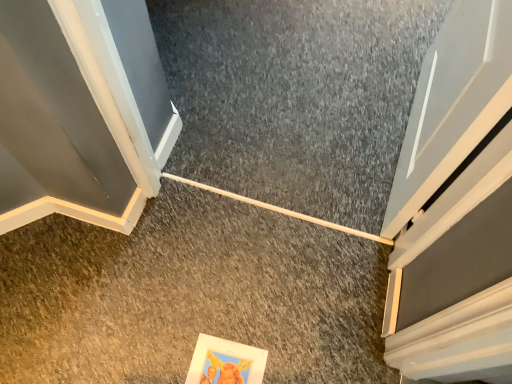
This screenshot has width=512, height=384. What do you see at coordinates (295, 97) in the screenshot? I see `smooth gray carpet at center, arranged as the 1th concrete when viewed from the back` at bounding box center [295, 97].

Find the location of `smooth gray carpet at center, arranged as the 2th concrete when viewed from the front`. smooth gray carpet at center, arranged as the 2th concrete when viewed from the front is located at coordinates (295, 97).

Image resolution: width=512 pixels, height=384 pixels. Describe the element at coordinates (189, 295) in the screenshot. I see `gray carpet at center, which is the second concrete in back-to-front order` at that location.

In order to click on gray carpet at center, the 1th concrete positioned from the front in this screenshot , I will do `click(189, 295)`.

The image size is (512, 384). Identify the location of smooth gray carpet at center, arranged as the 1th concrete when viewed from the back. (295, 97).

Does smooth gray carpet at center, arranged as the 1th concrete when viewed from the back, appear on the right side of gray carpet at center, which is the second concrete in back-to-front order?

Correct, you'll find smooth gray carpet at center, arranged as the 1th concrete when viewed from the back, to the right of gray carpet at center, which is the second concrete in back-to-front order.

In the image, is smooth gray carpet at center, arranged as the 1th concrete when viewed from the back, positioned in front of or behind gray carpet at center, which is the second concrete in back-to-front order?

Visually, smooth gray carpet at center, arranged as the 1th concrete when viewed from the back, is located behind gray carpet at center, which is the second concrete in back-to-front order.

Which point is more forward, (290, 47) or (276, 303)?

The point (276, 303) is closer.

From the image's perspective, relative to gray carpet at center, which is the second concrete in back-to-front order, is smooth gray carpet at center, arranged as the 1th concrete when viewed from the back, above or below?

Clearly, from the image's perspective, smooth gray carpet at center, arranged as the 1th concrete when viewed from the back, is above gray carpet at center, which is the second concrete in back-to-front order.

From a real-world perspective, is smooth gray carpet at center, arranged as the 1th concrete when viewed from the back, located beneath gray carpet at center, the 1th concrete positioned from the front?

Yes.

Is smooth gray carpet at center, arranged as the 2th concrete when viewed from the front, wider or thinner than gray carpet at center, the 1th concrete positioned from the front?

smooth gray carpet at center, arranged as the 2th concrete when viewed from the front, is wider than gray carpet at center, the 1th concrete positioned from the front.

Between smooth gray carpet at center, arranged as the 1th concrete when viewed from the back, and gray carpet at center, the 1th concrete positioned from the front, which one has less height?

Standing shorter between the two is smooth gray carpet at center, arranged as the 1th concrete when viewed from the back.

Based on the photo, is smooth gray carpet at center, arranged as the 1th concrete when viewed from the back, bigger or smaller than gray carpet at center, which is the second concrete in back-to-front order?

Considering their sizes, smooth gray carpet at center, arranged as the 1th concrete when viewed from the back, takes up more space than gray carpet at center, which is the second concrete in back-to-front order.

Does smooth gray carpet at center, arranged as the 2th concrete when viewed from the front, contain gray carpet at center, the 1th concrete positioned from the front?

Actually, gray carpet at center, the 1th concrete positioned from the front, is outside smooth gray carpet at center, arranged as the 2th concrete when viewed from the front.

Are smooth gray carpet at center, arranged as the 1th concrete when viewed from the back, and gray carpet at center, the 1th concrete positioned from the front, located far from each other?

No, smooth gray carpet at center, arranged as the 1th concrete when viewed from the back, is not far away from gray carpet at center, the 1th concrete positioned from the front.

Is smooth gray carpet at center, arranged as the 2th concrete when viewed from the front, turned away from gray carpet at center, which is the second concrete in back-to-front order?

Yes, gray carpet at center, which is the second concrete in back-to-front order, is at the back of smooth gray carpet at center, arranged as the 2th concrete when viewed from the front.

Looking at this image, measure the distance between smooth gray carpet at center, arranged as the 1th concrete when viewed from the back, and gray carpet at center, the 1th concrete positioned from the front.

smooth gray carpet at center, arranged as the 1th concrete when viewed from the back, is 19.15 inches from gray carpet at center, the 1th concrete positioned from the front.

This screenshot has height=384, width=512. In the image, there is a gray carpet at center, which is the second concrete in back-to-front order. Find the location of `concrete below it (from a real-world perspective)`. concrete below it (from a real-world perspective) is located at coordinates (295, 97).

Is gray carpet at center, which is the second concrete in back-to-front order, at the right side of smooth gray carpet at center, arranged as the 1th concrete when viewed from the back?

No.

Which is behind, gray carpet at center, the 1th concrete positioned from the front, or smooth gray carpet at center, arranged as the 1th concrete when viewed from the back?

smooth gray carpet at center, arranged as the 1th concrete when viewed from the back, is further away from the camera.

Between point (165, 189) and point (399, 109), which one is positioned behind?

Positioned behind is point (399, 109).

From the image's perspective, does gray carpet at center, which is the second concrete in back-to-front order, appear lower than smooth gray carpet at center, arranged as the 1th concrete when viewed from the back?

Indeed, from the image's perspective, gray carpet at center, which is the second concrete in back-to-front order, is shown beneath smooth gray carpet at center, arranged as the 1th concrete when viewed from the back.

From a real-world perspective, who is located higher, gray carpet at center, the 1th concrete positioned from the front, or smooth gray carpet at center, arranged as the 1th concrete when viewed from the back?

From a 3D spatial view, gray carpet at center, the 1th concrete positioned from the front, is above.

Is gray carpet at center, the 1th concrete positioned from the front, thinner than smooth gray carpet at center, arranged as the 2th concrete when viewed from the front?

Correct, the width of gray carpet at center, the 1th concrete positioned from the front, is less than that of smooth gray carpet at center, arranged as the 2th concrete when viewed from the front.

Which of these two, gray carpet at center, the 1th concrete positioned from the front, or smooth gray carpet at center, arranged as the 2th concrete when viewed from the front, stands shorter?

smooth gray carpet at center, arranged as the 2th concrete when viewed from the front, is shorter.

Looking at this image, which of these two, gray carpet at center, which is the second concrete in back-to-front order, or smooth gray carpet at center, arranged as the 1th concrete when viewed from the back, is smaller?

Smaller between the two is gray carpet at center, which is the second concrete in back-to-front order.

Is gray carpet at center, the 1th concrete positioned from the front, surrounding smooth gray carpet at center, arranged as the 1th concrete when viewed from the back?

No, smooth gray carpet at center, arranged as the 1th concrete when viewed from the back, is not inside gray carpet at center, the 1th concrete positioned from the front.

Does gray carpet at center, the 1th concrete positioned from the front, touch smooth gray carpet at center, arranged as the 2th concrete when viewed from the front?

No.

Is gray carpet at center, the 1th concrete positioned from the front, oriented away from smooth gray carpet at center, arranged as the 2th concrete when viewed from the front?

gray carpet at center, the 1th concrete positioned from the front, does not have its back to smooth gray carpet at center, arranged as the 2th concrete when viewed from the front.

Can you tell me how much gray carpet at center, which is the second concrete in back-to-front order, and smooth gray carpet at center, arranged as the 2th concrete when viewed from the front, differ in facing direction?

The angular difference between gray carpet at center, which is the second concrete in back-to-front order, and smooth gray carpet at center, arranged as the 2th concrete when viewed from the front, is 0.907 degrees.

How much distance is there between gray carpet at center, which is the second concrete in back-to-front order, and smooth gray carpet at center, arranged as the 2th concrete when viewed from the front?

gray carpet at center, which is the second concrete in back-to-front order, is 19.15 inches away from smooth gray carpet at center, arranged as the 2th concrete when viewed from the front.

The height and width of the screenshot is (384, 512). I want to click on concrete in front of the smooth gray carpet at center, arranged as the 1th concrete when viewed from the back, so click(189, 295).

You are a GUI agent. You are given a task and a screenshot of the screen. Output one action in this format:
    pyautogui.click(x=<x>, y=<y>)
    Task: Click on the concrete below the smooth gray carpet at center, arranged as the 2th concrete when viewed from the front (from the image's perspective)
    The width and height of the screenshot is (512, 384).
    Given the screenshot: What is the action you would take?
    pyautogui.click(x=189, y=295)

The height and width of the screenshot is (384, 512). What are the coordinates of `concrete on the left side of smooth gray carpet at center, arranged as the 2th concrete when viewed from the front` in the screenshot? It's located at (189, 295).